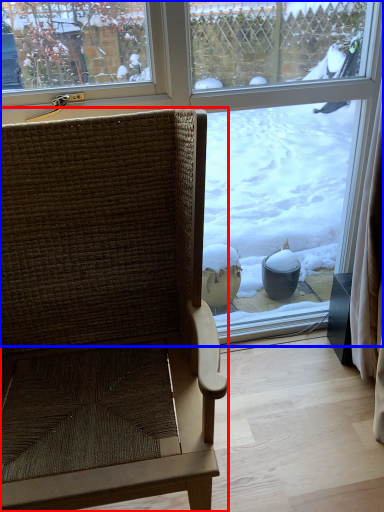
Question: Which point is further to the camera, chair (highlighted by a red box) or window (highlighted by a blue box)?

Choices:
 (A) chair
 (B) window

Answer: (B)